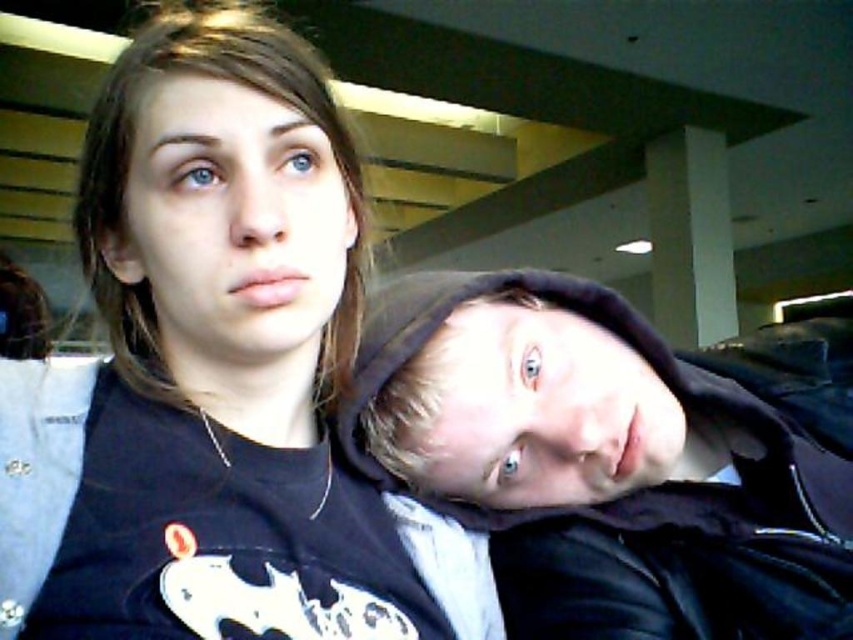
From the picture: You are holding a 16 inch wide box and want to place it on the black hoodie at upper right. Can the box fit on the hoodie without overlapping the edges?

The black hoodie at upper right is 17.90 inches away from the viewer. Since the box is 16 inches wide, it can fit on the hoodie without overlapping the edges as there is enough space.